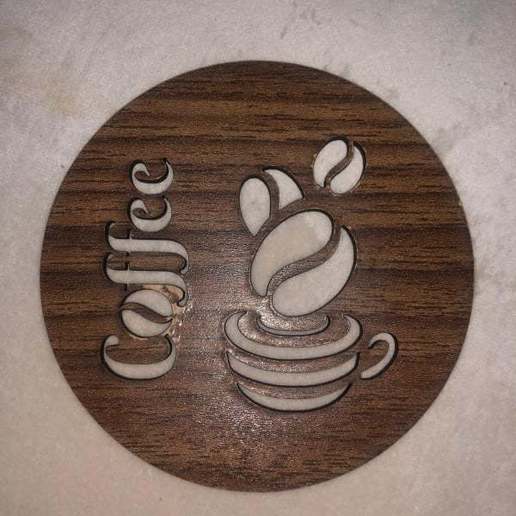
In order to click on wood grain light in this screenshot , I will do `click(408, 296)`.